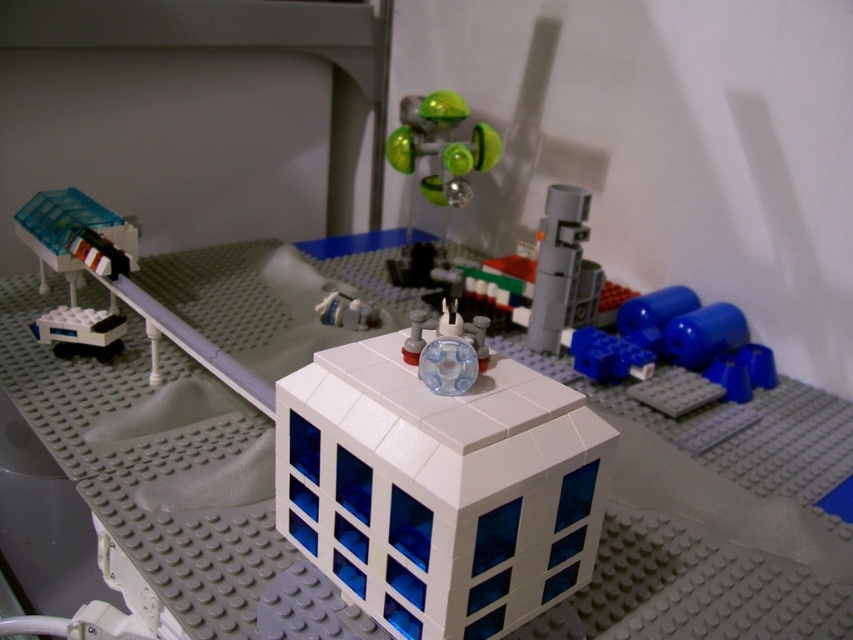
Question: From the image, what is the correct spatial relationship of white matte building at center in relation to white plastic train at lower left?

Choices:
 (A) left
 (B) right

Answer: (B)

Question: Which object is the closest to the white matte building at center?

Choices:
 (A) satin gray cylinder at center
 (B) white plastic train at lower left
 (C) translucent blue plastic train car at left

Answer: (A)

Question: Among these points, which one is farthest from the camera?

Choices:
 (A) (550, 208)
 (B) (393, 426)
 (C) (71, 262)

Answer: (C)

Question: Does satin gray cylinder at center have a larger size compared to white plastic train at lower left?

Choices:
 (A) no
 (B) yes

Answer: (B)

Question: Among these objects, which one is nearest to the camera?

Choices:
 (A) white matte building at center
 (B) translucent blue plastic train car at left

Answer: (A)

Question: Does satin gray cylinder at center appear on the left side of white plastic train at lower left?

Choices:
 (A) no
 (B) yes

Answer: (A)